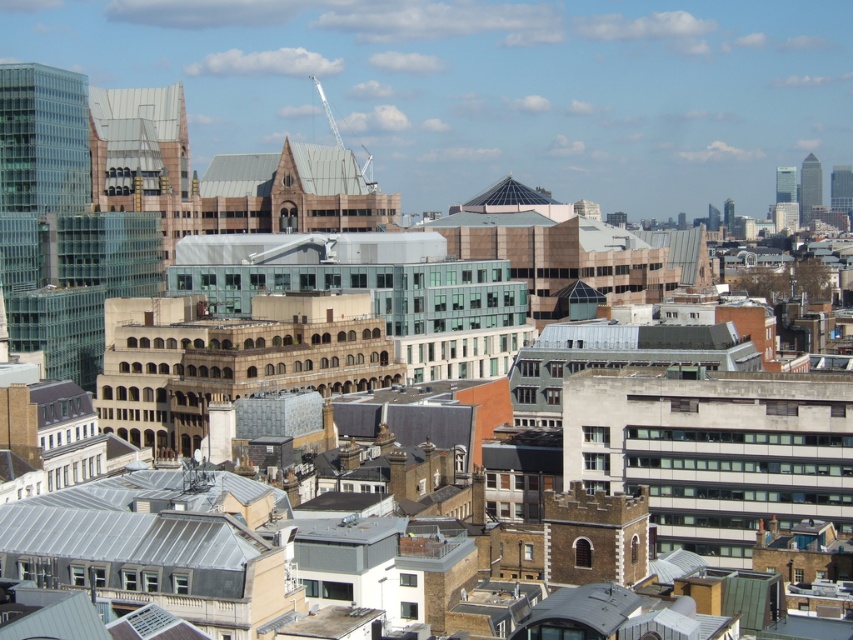
You are standing in the city square and want to take a photo of the glassy silver skyscraper at upper right. Considering the distance, will you need a telephoto lens to capture the entire building in your shot?

The glassy silver skyscraper at upper right is 609.05 meters away from the viewer. A telephoto lens is necessary to capture the entire building at this distance.